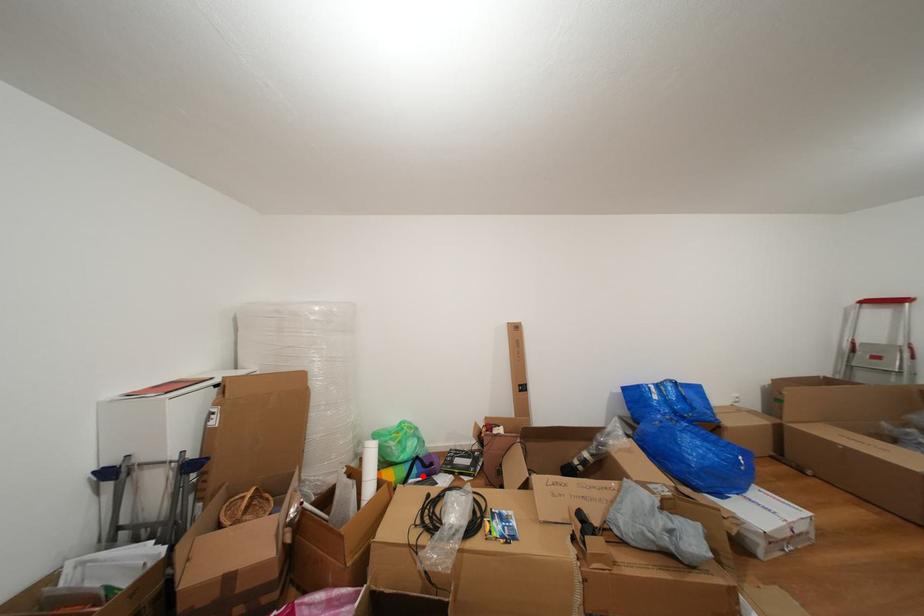
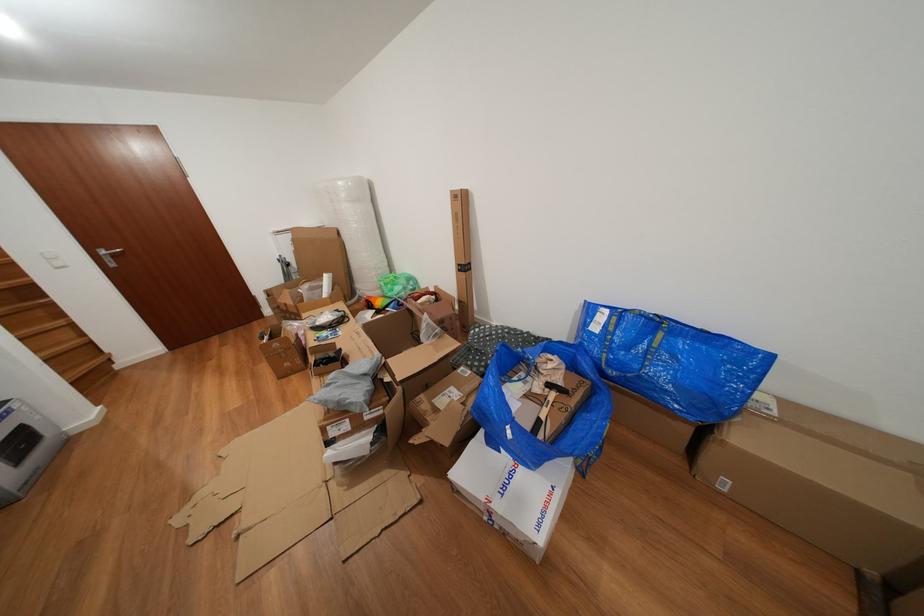
Question: I am providing you with two images of the same scene from different viewpoints. Image1 has a red point marked. In image2, the corresponding 3D location appears at what relative position? Reply with the corresponding letter.

Choices:
 (A) Closer
 (B) Farther

Answer: (B)